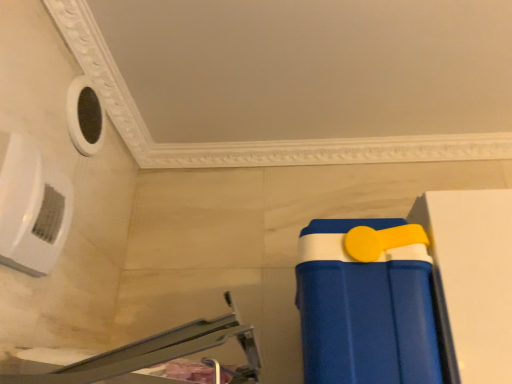
The width and height of the screenshot is (512, 384). Describe the element at coordinates (365, 309) in the screenshot. I see `blue plastic cooler at lower right` at that location.

Where is `blue plastic cooler at lower right`? The height and width of the screenshot is (384, 512). blue plastic cooler at lower right is located at coordinates (365, 309).

Image resolution: width=512 pixels, height=384 pixels. What do you see at coordinates (158, 353) in the screenshot?
I see `blue plastic tray at lower right` at bounding box center [158, 353].

Find the location of `blue plastic tray at lower right`. blue plastic tray at lower right is located at coordinates (158, 353).

You are a GUI agent. You are given a task and a screenshot of the screen. Output one action in this format:
    pyautogui.click(x=<x>, y=<y>)
    Task: Click on the blue plastic cooler at lower right
    This screenshot has width=512, height=384.
    Given the screenshot: What is the action you would take?
    pyautogui.click(x=365, y=309)

Considering the positions of objects blue plastic tray at lower right and blue plastic cooler at lower right in the image provided, who is more to the right, blue plastic tray at lower right or blue plastic cooler at lower right?

blue plastic cooler at lower right.

Is blue plastic tray at lower right positioned in front of blue plastic cooler at lower right?

Yes, it is in front of blue plastic cooler at lower right.

Considering the positions of points (90, 380) and (398, 324), is point (90, 380) farther from camera compared to point (398, 324)?

That is False.

In the scene shown: From the image's perspective, which is above, blue plastic tray at lower right or blue plastic cooler at lower right?

blue plastic tray at lower right is shown above in the image.

From a real-world perspective, does blue plastic tray at lower right sit lower than blue plastic cooler at lower right?

Indeed, from a real-world perspective, blue plastic tray at lower right is positioned beneath blue plastic cooler at lower right.

Considering the sizes of blue plastic tray at lower right and blue plastic cooler at lower right in the image, is blue plastic tray at lower right wider or thinner than blue plastic cooler at lower right?

blue plastic tray at lower right is wider than blue plastic cooler at lower right.

Is blue plastic tray at lower right shorter than blue plastic cooler at lower right?

Yes.

Does blue plastic tray at lower right have a smaller size compared to blue plastic cooler at lower right?

No.

Is blue plastic cooler at lower right located within blue plastic tray at lower right?

That's incorrect, blue plastic cooler at lower right is not inside blue plastic tray at lower right.

Are blue plastic tray at lower right and blue plastic cooler at lower right located far from each other?

That's not correct — blue plastic tray at lower right is a little close to blue plastic cooler at lower right.

Is blue plastic tray at lower right positioned with its back to blue plastic cooler at lower right?

That's not correct — blue plastic tray at lower right is not looking away from blue plastic cooler at lower right.

From the picture: How many degrees apart are the facing directions of blue plastic tray at lower right and blue plastic cooler at lower right?

The angle between the facing direction of blue plastic tray at lower right and the facing direction of blue plastic cooler at lower right is 0.000424 degrees.

Locate an element on the screen. This screenshot has height=384, width=512. toy positioned vertically above the blue plastic tray at lower right (from a real-world perspective) is located at coordinates (365, 309).

Which object is positioned more to the right, blue plastic cooler at lower right or blue plastic tray at lower right?

Result: From the viewer's perspective, blue plastic cooler at lower right appears more on the right side.

Is blue plastic cooler at lower right in front of or behind blue plastic tray at lower right in the image?

blue plastic cooler at lower right is behind blue plastic tray at lower right.

Which is behind, point (359, 299) or point (89, 382)?

The point (359, 299) is behind.

From the image's perspective, is blue plastic cooler at lower right below blue plastic tray at lower right?

Yes, from the image's perspective, blue plastic cooler at lower right is beneath blue plastic tray at lower right.

From a real-world perspective, is blue plastic cooler at lower right on top of blue plastic tray at lower right?

Yes.

Does blue plastic cooler at lower right have a lesser width compared to blue plastic tray at lower right?

Yes, blue plastic cooler at lower right is thinner than blue plastic tray at lower right.

Considering the sizes of objects blue plastic cooler at lower right and blue plastic tray at lower right in the image provided, who is shorter, blue plastic cooler at lower right or blue plastic tray at lower right?

Standing shorter between the two is blue plastic tray at lower right.

Between blue plastic cooler at lower right and blue plastic tray at lower right, which one has larger size?

Bigger between the two is blue plastic tray at lower right.

Is blue plastic cooler at lower right not inside blue plastic tray at lower right?

That's correct, blue plastic cooler at lower right is outside of blue plastic tray at lower right.

Is blue plastic cooler at lower right placed right next to blue plastic tray at lower right?

No, blue plastic cooler at lower right is not touching blue plastic tray at lower right.

Is blue plastic cooler at lower right aimed at blue plastic tray at lower right?

No, blue plastic cooler at lower right is not facing towards blue plastic tray at lower right.

How different are the orientations of blue plastic cooler at lower right and blue plastic tray at lower right in degrees?

There is a 0.000424-degree angle between the facing directions of blue plastic cooler at lower right and blue plastic tray at lower right.

I want to click on furniture that is on the left side of blue plastic cooler at lower right, so click(158, 353).

At what (x,y) coordinates should I click in order to perform the action: click on furniture above the blue plastic cooler at lower right (from the image's perspective). Please return your answer as a coordinate pair (x, y). This screenshot has height=384, width=512. Looking at the image, I should click on (158, 353).

Identify the location of furniture in front of the blue plastic cooler at lower right. This screenshot has width=512, height=384. (158, 353).